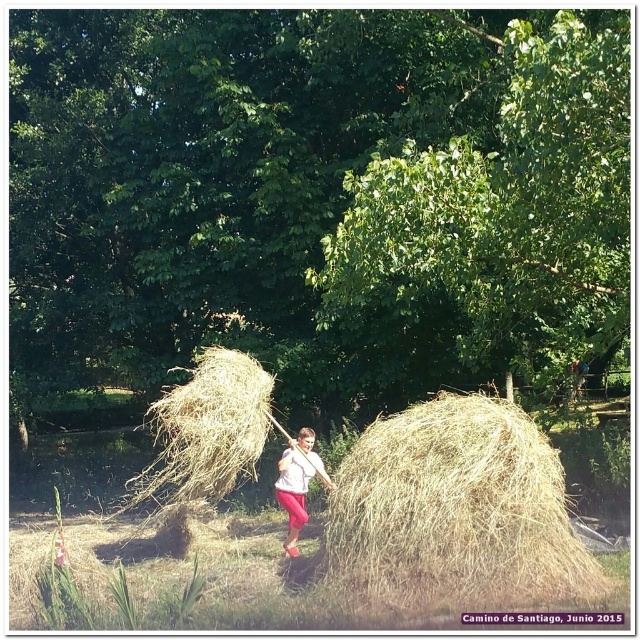
Which is in front, point (500, 484) or point (298, 458)?

Point (500, 484) is more forward.

Based on the photo, between dry straw bale at center and pink fabric girl at center, which one is positioned higher?

dry straw bale at center

Between point (540, 444) and point (289, 476), which one is positioned behind?

The point (289, 476) is more distant.

At what (x,y) coordinates should I click in order to perform the action: click on dry straw bale at center. Please return your answer as a coordinate pair (x, y). This screenshot has height=640, width=640. Looking at the image, I should click on (452, 509).

From the picture: Can you confirm if dry straw at center is smaller than pink fabric girl at center?

Incorrect, dry straw at center is not smaller in size than pink fabric girl at center.

Is point (211, 372) closer to camera compared to point (300, 452)?

Yes, it is.

What do you see at coordinates (204, 432) in the screenshot? The height and width of the screenshot is (640, 640). I see `dry straw at center` at bounding box center [204, 432].

Identify the location of dry straw at center. The image size is (640, 640). (204, 432).

Between dry straw bale at center and dry straw at center, which one appears on the right side from the viewer's perspective?

dry straw bale at center is more to the right.

This screenshot has height=640, width=640. Describe the element at coordinates (452, 509) in the screenshot. I see `dry straw bale at center` at that location.

You are a GUI agent. You are given a task and a screenshot of the screen. Output one action in this format:
    pyautogui.click(x=<x>, y=<y>)
    Task: Click on the dry straw bale at center
    
    Given the screenshot: What is the action you would take?
    pyautogui.click(x=452, y=509)